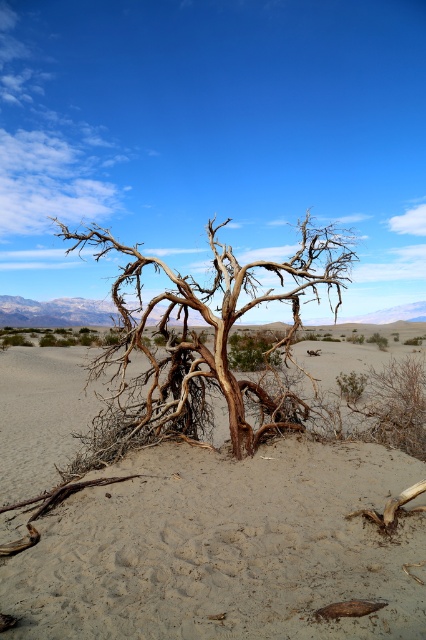
You are a desert explorer who needs to set up a tent. You have two options for the location of your tent. One is on the brown sandy soil at center, and the other is near the brown textured tree at center. Based on the terrain, which location would provide a more stable foundation for your tent?

The brown sandy soil at center is located below the brown textured tree at center, so setting up the tent on the brown sandy soil at center would provide a more stable foundation since the soil is likely compacted beneath the tree roots, offering better support compared to loose sand away from the tree.

You are a desert explorer carrying a 3 meter long rope. You want to measure the distance between the brown sandy soil at center and the gnarled dead tree at center. Can you do it with the rope?

The distance between the brown sandy soil at center and the gnarled dead tree at center is 3.18 meters. Since the rope is only 3 meters long, it is not long enough to measure the entire distance.